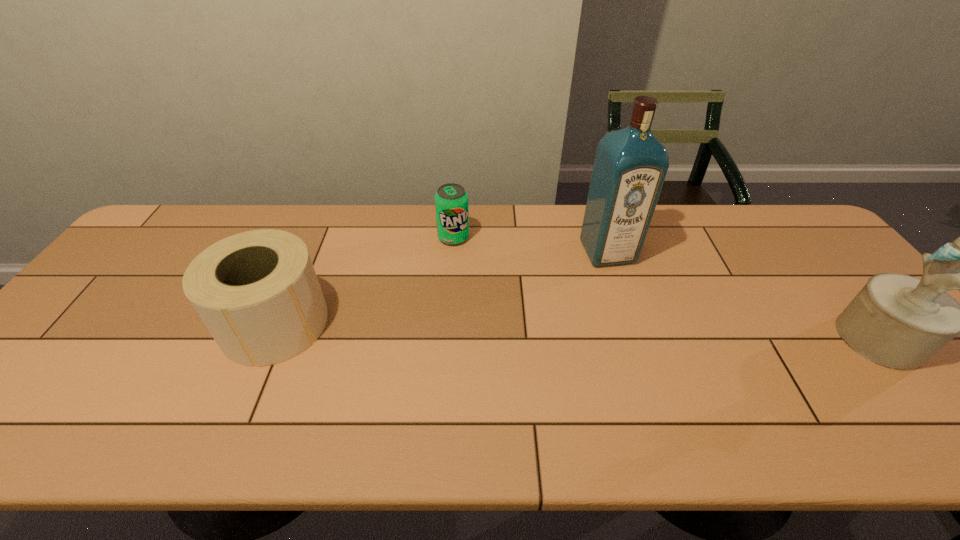
Identify the location of the third tallest object. This screenshot has height=540, width=960. (257, 292).

The height and width of the screenshot is (540, 960). I want to click on the leftmost object, so click(x=257, y=292).

Image resolution: width=960 pixels, height=540 pixels. In order to click on figurine in this screenshot , I will do `click(897, 321)`.

Find the location of a particular element. This screenshot has width=960, height=540. the rightmost object is located at coordinates (897, 321).

Locate an element on the screen. the second object from right to left is located at coordinates (630, 166).

Locate an element on the screen. The width and height of the screenshot is (960, 540). liquor is located at coordinates (630, 166).

The height and width of the screenshot is (540, 960). I want to click on the second object from left to right, so click(451, 201).

This screenshot has height=540, width=960. In order to click on the shortest object in this screenshot , I will do `click(451, 201)`.

Where is `vacant space located 0.260m on the left of the toilet tissue`? vacant space located 0.260m on the left of the toilet tissue is located at coordinates (122, 323).

I want to click on free spot located at the beak of the rightmost object, so click(x=793, y=339).